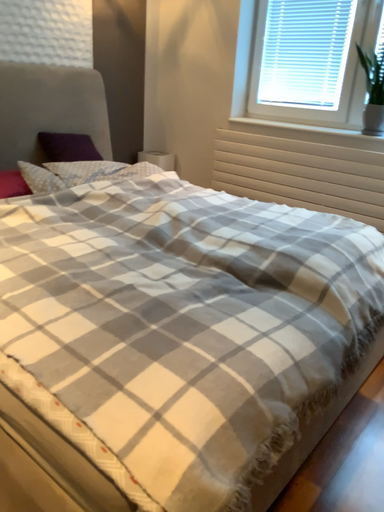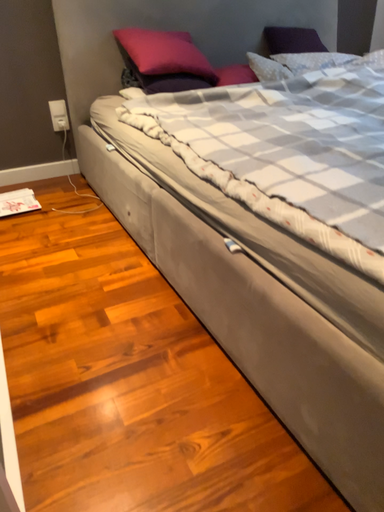
Question: How did the camera likely rotate when shooting the video?

Choices:
 (A) rotated downward
 (B) rotated upward

Answer: (A)